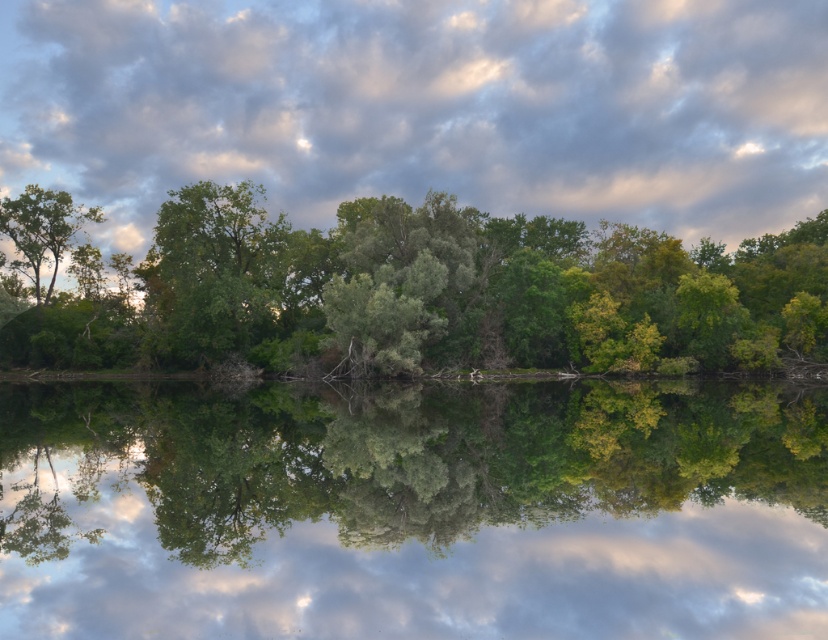
Does cloudy sky at upper center have a larger size compared to green matte tree at left?

Yes.

The width and height of the screenshot is (828, 640). What are the coordinates of `cloudy sky at upper center` in the screenshot? It's located at (424, 108).

Where is `cloudy sky at upper center`? The height and width of the screenshot is (640, 828). cloudy sky at upper center is located at coordinates (424, 108).

Who is more distant from viewer, (210, 417) or (61, 257)?

The point (61, 257) is more distant.

Can you confirm if green leafy river at center is shorter than green matte tree at left?

Indeed, green leafy river at center has a lesser height compared to green matte tree at left.

Identify the location of green leafy river at center. The width and height of the screenshot is (828, 640). (414, 509).

The height and width of the screenshot is (640, 828). I want to click on green leafy river at center, so click(x=414, y=509).

Does green leafy river at center come in front of green leafy tree at center?

Yes, green leafy river at center is in front of green leafy tree at center.

Is green leafy river at center above green leafy tree at center?

No, green leafy river at center is not above green leafy tree at center.

Is point (85, 416) farther from camera compared to point (266, 241)?

No, it is in front of (266, 241).

Where is `green leafy river at center`? green leafy river at center is located at coordinates (414, 509).